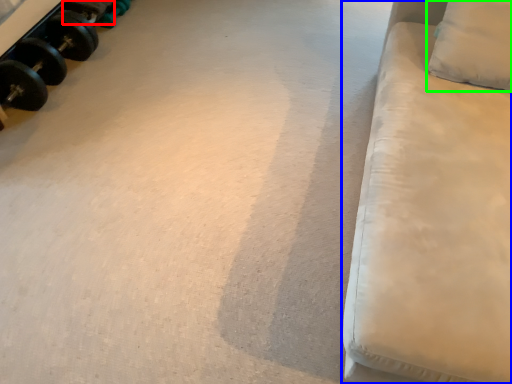
Question: Which is nearer to the dumbbell (highlighted by a red box)? furniture (highlighted by a blue box) or pillow (highlighted by a green box).

Choices:
 (A) furniture
 (B) pillow

Answer: (B)